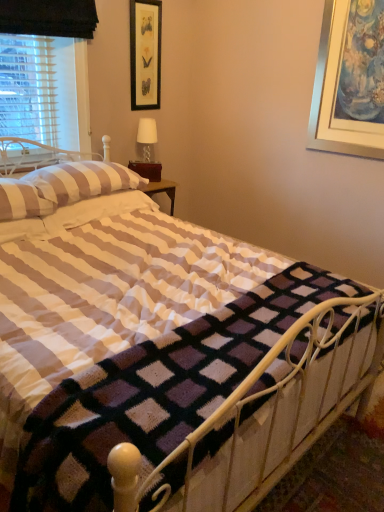
Question: Considering the relative sizes of white fabric lampshade at upper center and white striped pillow at upper left, positioned as the 1th pillow in front-to-back order, in the image provided, is white fabric lampshade at upper center shorter than white striped pillow at upper left, positioned as the 1th pillow in front-to-back order,?

Choices:
 (A) no
 (B) yes

Answer: (A)

Question: Considering the relative sizes of white fabric lampshade at upper center and white striped pillow at upper left, positioned as the 1th pillow in front-to-back order, in the image provided, is white fabric lampshade at upper center taller than white striped pillow at upper left, positioned as the 1th pillow in front-to-back order,?

Choices:
 (A) yes
 (B) no

Answer: (A)

Question: Is white fabric lampshade at upper center thinner than white striped pillow at upper left, which is counted as the second pillow, starting from the back?

Choices:
 (A) no
 (B) yes

Answer: (B)

Question: Is white fabric lampshade at upper center further to camera compared to white striped pillow at upper left, positioned as the 1th pillow in front-to-back order?

Choices:
 (A) no
 (B) yes

Answer: (B)

Question: Does white fabric lampshade at upper center appear on the right side of white striped pillow at upper left, positioned as the 1th pillow in front-to-back order?

Choices:
 (A) no
 (B) yes

Answer: (B)

Question: Does white fabric lampshade at upper center turn towards white striped pillow at upper left, positioned as the 1th pillow in front-to-back order?

Choices:
 (A) no
 (B) yes

Answer: (A)

Question: Does white striped fabric at left turn towards black framed picture at upper center?

Choices:
 (A) no
 (B) yes

Answer: (A)

Question: Is white striped fabric at left oriented away from black framed picture at upper center?

Choices:
 (A) no
 (B) yes

Answer: (A)

Question: Considering the relative positions of white striped fabric at left and black framed picture at upper center in the image provided, is white striped fabric at left behind black framed picture at upper center?

Choices:
 (A) yes
 (B) no

Answer: (B)

Question: From the image's perspective, is white striped fabric at left below black framed picture at upper center?

Choices:
 (A) yes
 (B) no

Answer: (A)

Question: Is white striped fabric at left at the left side of black framed picture at upper center?

Choices:
 (A) no
 (B) yes

Answer: (B)

Question: From the image's perspective, does white striped fabric at left appear higher than black framed picture at upper center?

Choices:
 (A) no
 (B) yes

Answer: (A)

Question: Is the depth of white striped pillow at upper left, the 2th pillow positioned from the front, greater than that of white fabric lampshade at upper center?

Choices:
 (A) yes
 (B) no

Answer: (B)